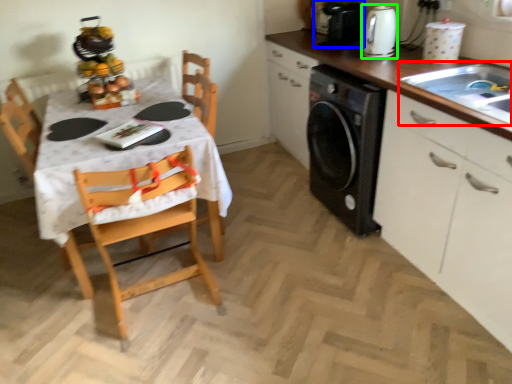
Question: Which object is the closest to the sink (highlighted by a red box)? Choose among these: appliance (highlighted by a blue box) or kitchen appliance (highlighted by a green box).

Choices:
 (A) appliance
 (B) kitchen appliance

Answer: (B)